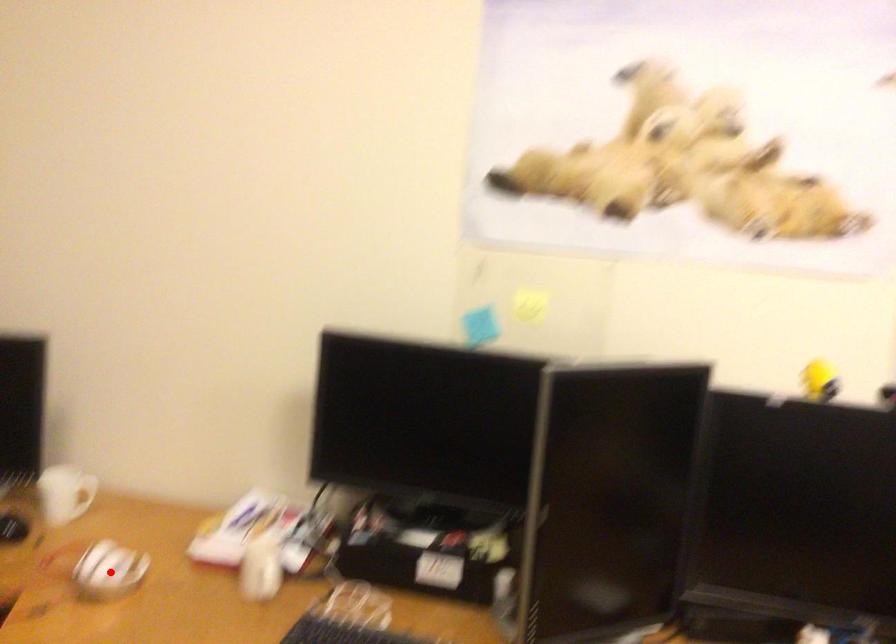
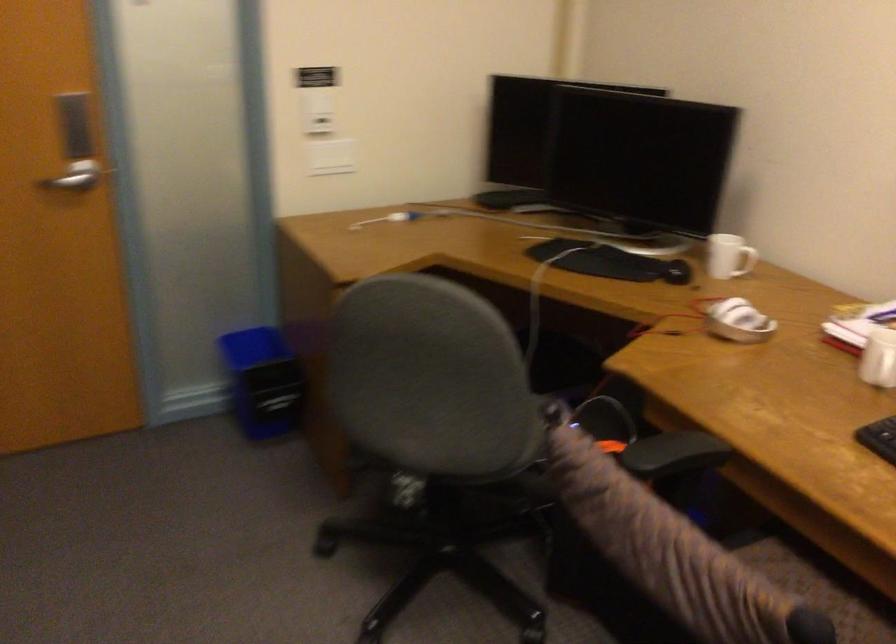
The point at the highlighted location is marked in the first image. Where is the corresponding point in the second image?

(737, 321)